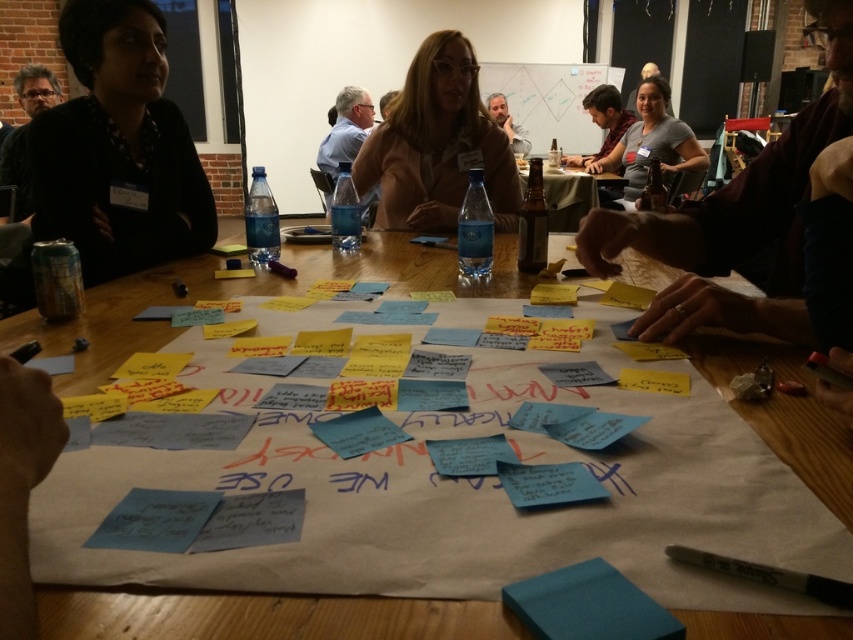
You are a project manager who needs to place a new 1.5 feet wide presentation board between the whiteboard at upper center and the brown glass bottle at center. Based on the distance between them, will there be enough space to place the presentation board without moving either object?

The whiteboard at upper center is 4.89 feet from the brown glass bottle at center. Since the presentation board is 1.5 feet wide, there is sufficient space between them to place it without moving either object.

You are organizing a meeting and need to place a 1.5 meter tall presentation screen between the whiteboard at upper center and the brown glass bottle at center. Based on their heights, will the screen fit vertically between them?

The whiteboard at upper center is much taller than the brown glass bottle at center. Since the screen is 1.5 meters tall, it might not fit vertically between them if the whiteboard is significantly taller, but the exact dimensions aren